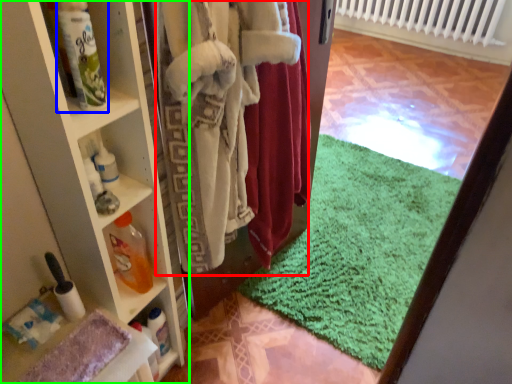
Question: Estimate the real-world distances between objects in this image. Which object is farther from clothing (highlighted by a red box), bottle (highlighted by a blue box) or shelf (highlighted by a green box)?

Choices:
 (A) bottle
 (B) shelf

Answer: (A)